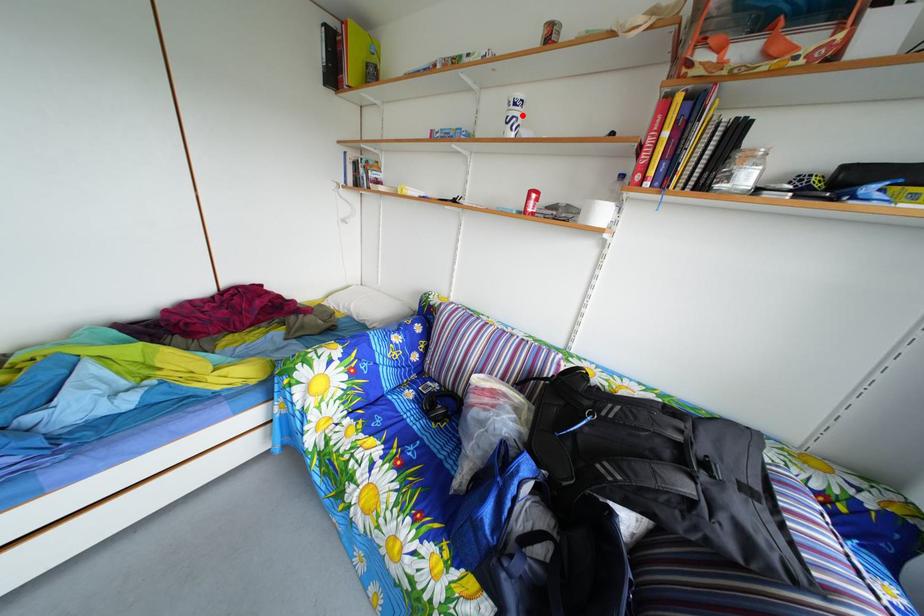
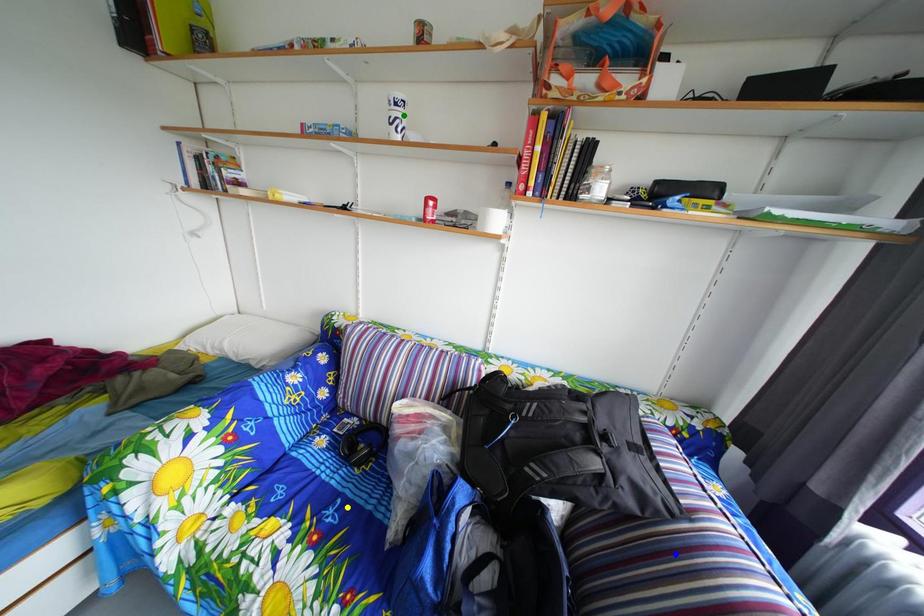
Question: I am providing you with two images of the same scene from different viewpoints. A red point is marked on the first image. You are given multiple points on the second image. In image 2, which mark is for the same physical point as the one in image 1?

Choices:
 (A) green point
 (B) blue point
 (C) yellow point

Answer: (A)